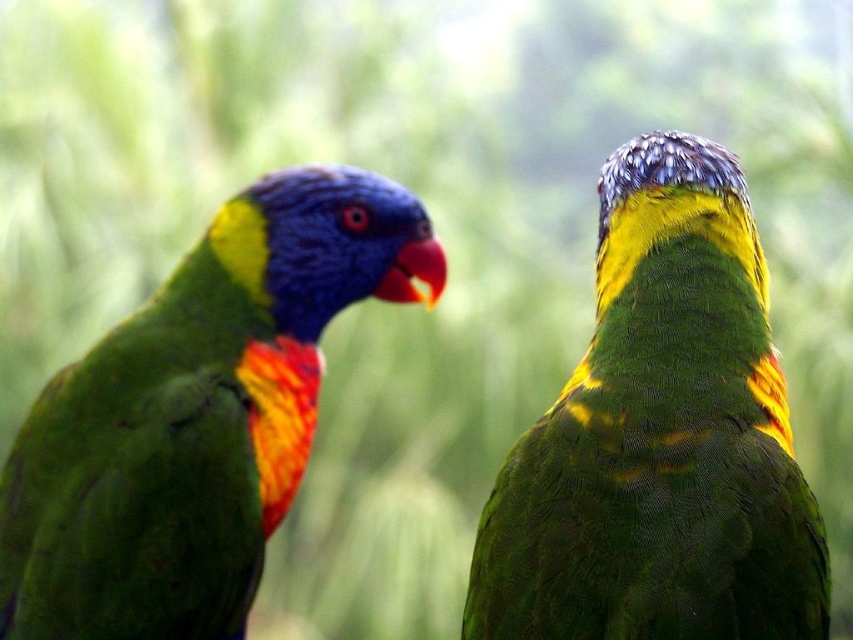
Consider the image. You are a birdwatcher observing two parrots in a garden. You see a green matte parrot at upper right and a shiny multicolored parrot at left. Which parrot is positioned to the right of the other?

The green matte parrot at upper right is positioned to the right of the shiny multicolored parrot at left.

In the scene shown: You are a photographer trying to capture a clear photo of both the green matte parrot at upper right and the shiny multicolored parrot at left. Since you can only focus on one bird at a time, which bird should you focus on to ensure the other is still somewhat in focus?

You should focus on the green matte parrot at upper right because it is closer to the viewer than the shiny multicolored parrot at left. By focusing on the closer bird, the depth of field may still keep the farther bird somewhat in focus.

You are a birdwatcher trying to capture both the green matte parrot at upper right and the shiny multicolored parrot at left in a single photo. The camera you have can focus on subjects within a 50 cm range. Can you fit both birds in the frame without moving the camera?

The green matte parrot at upper right is 46.05 centimeters away from the shiny multicolored parrot at left. Since the distance between them is less than 50 cm, you can fit both birds in the frame without moving the camera.